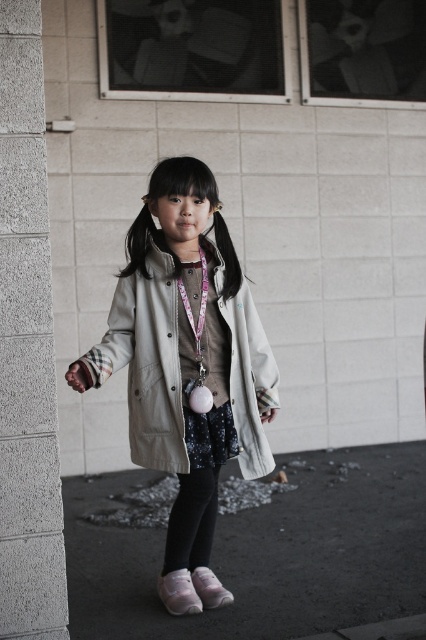
You are a delivery robot that needs to place a small package on the black asphalt at lower center. However, there is a pink fabric lanyard at center in the way. Can you move the lanyard to the side to make space?

The black asphalt at lower center might be wider than the pink fabric lanyard at center, so there might be enough space to move the lanyard aside and place the package.

You are taking a photo of the girl in the scene. You want to focus on the point at point (x=34, y=484) and point (x=198, y=387). Which point should you focus on first to ensure both points are in focus?

You should focus on point (x=34, y=484) first because it is closer to the camera than point (x=198, y=387), ensuring both points are within the depth of field.

You are a fashion designer observing the girl in the image. You need to decide which item is higher in position between the pink fabric lanyard at center and the white suede shoe at lower center. Which one is higher?

The pink fabric lanyard at center is taller than the white suede shoe at lower center, so the pink fabric lanyard at center is higher in position.